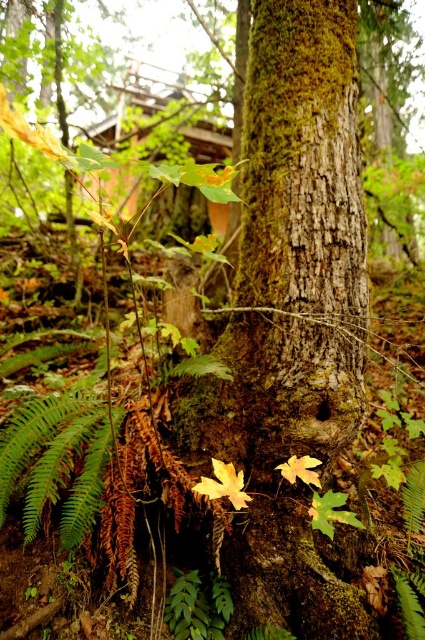
Question: Is green glossy fern at lower left positioned behind yellow matte maple leaf at center?

Choices:
 (A) no
 (B) yes

Answer: (B)

Question: Which is farther from the yellow matte maple leaf at lower center?

Choices:
 (A) yellow matte maple leaf at center
 (B) green glossy fern at lower left

Answer: (B)

Question: Which of the following is the farthest from the observer?

Choices:
 (A) yellow matte maple leaf at center
 (B) yellow matte maple leaf at lower center

Answer: (B)

Question: Which point appears closest to the camera in this image?

Choices:
 (A) (238, 477)
 (B) (297, 470)

Answer: (A)

Question: Does green glossy fern at lower left appear on the right side of yellow matte maple leaf at lower center?

Choices:
 (A) no
 (B) yes

Answer: (A)

Question: Can you confirm if green glossy fern at lower left is positioned below yellow matte maple leaf at center?

Choices:
 (A) no
 (B) yes

Answer: (A)